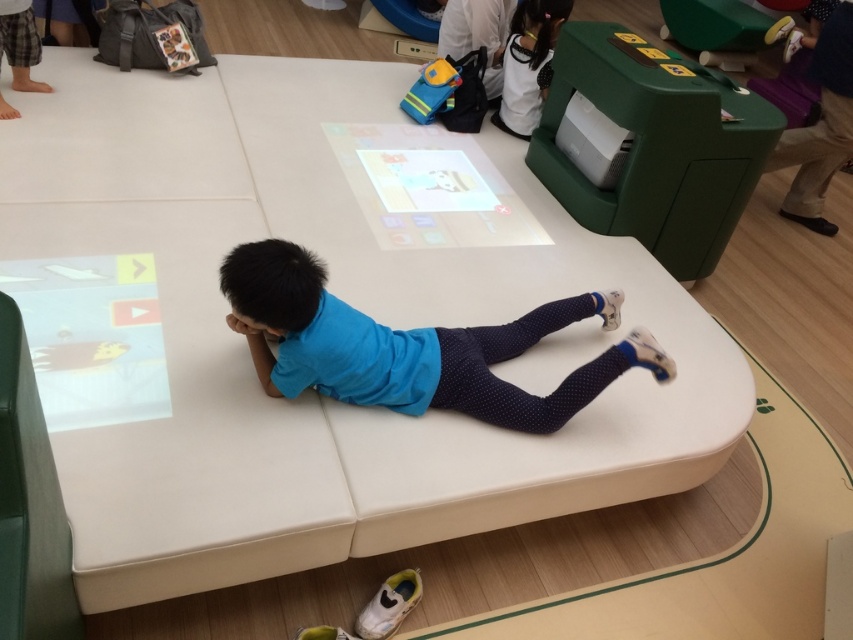
Does blue fabric shirt at center have a larger size compared to white matte shirt at upper right?

Indeed, blue fabric shirt at center has a larger size compared to white matte shirt at upper right.

Can you confirm if blue fabric shirt at center is thinner than white matte shirt at upper right?

No.

Image resolution: width=853 pixels, height=640 pixels. What do you see at coordinates (412, 346) in the screenshot? I see `blue fabric shirt at center` at bounding box center [412, 346].

The width and height of the screenshot is (853, 640). What are the coordinates of `blue fabric shirt at center` in the screenshot? It's located at (412, 346).